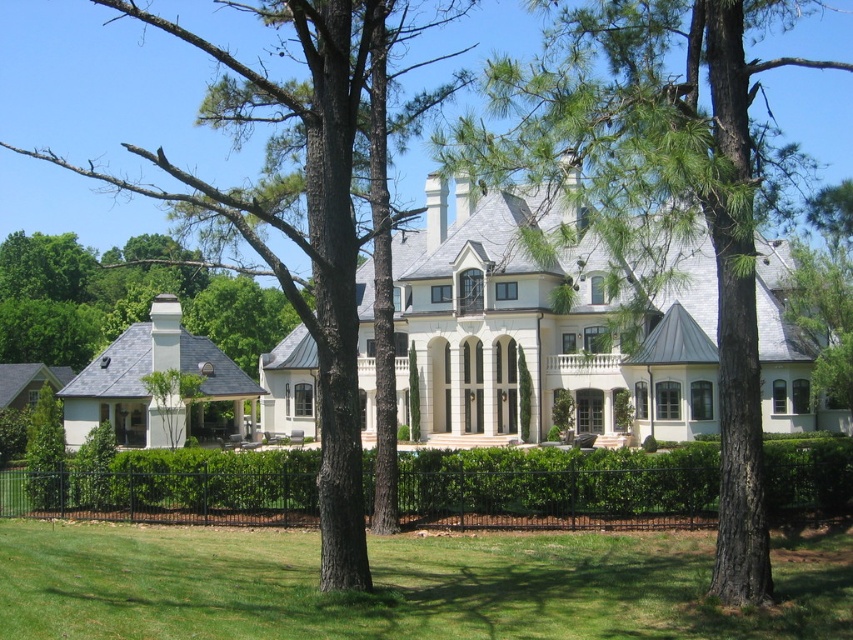
Between green grass at lower center and green textured tree at center, which one has more height?

Standing taller between the two is green textured tree at center.

Measure the distance between point (59, 598) and camera.

Point (59, 598) is 41.95 meters from camera.

Where is `green grass at lower center`? Image resolution: width=853 pixels, height=640 pixels. green grass at lower center is located at coordinates (401, 584).

Which is below, green grass at lower center or smooth bark tree at center?

green grass at lower center is below.

Which is above, green grass at lower center or smooth bark tree at center?

smooth bark tree at center is above.

Is point (822, 563) closer to camera compared to point (132, 16)?

That is False.

What are the coordinates of `green grass at lower center` in the screenshot? It's located at (401, 584).

Is white smooth mansion at center smaller than smooth bark tree at center?

Yes, white smooth mansion at center is smaller than smooth bark tree at center.

Between point (685, 429) and point (321, 33), which one is positioned in front?

Point (321, 33) is more forward.

Identify the location of white smooth mansion at center. (540, 332).